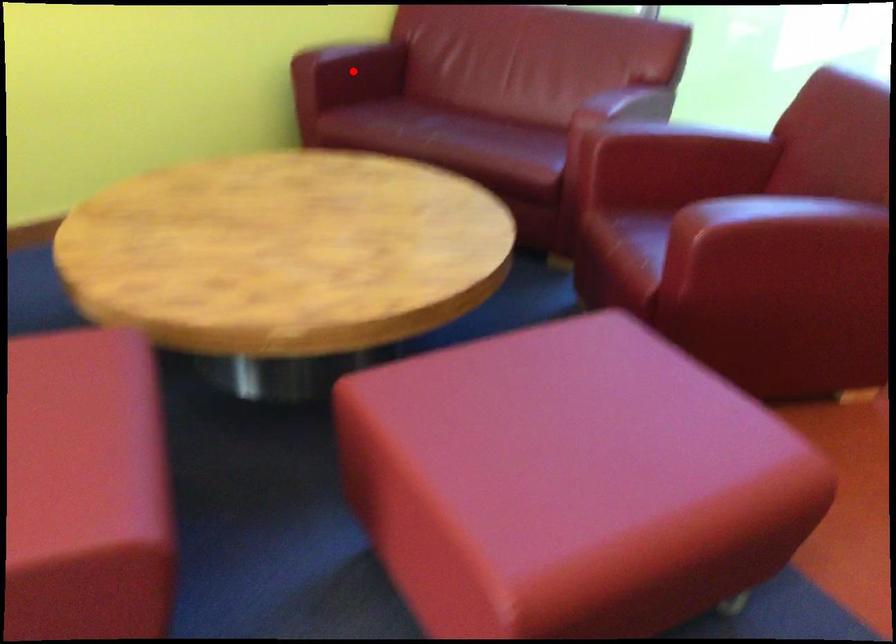
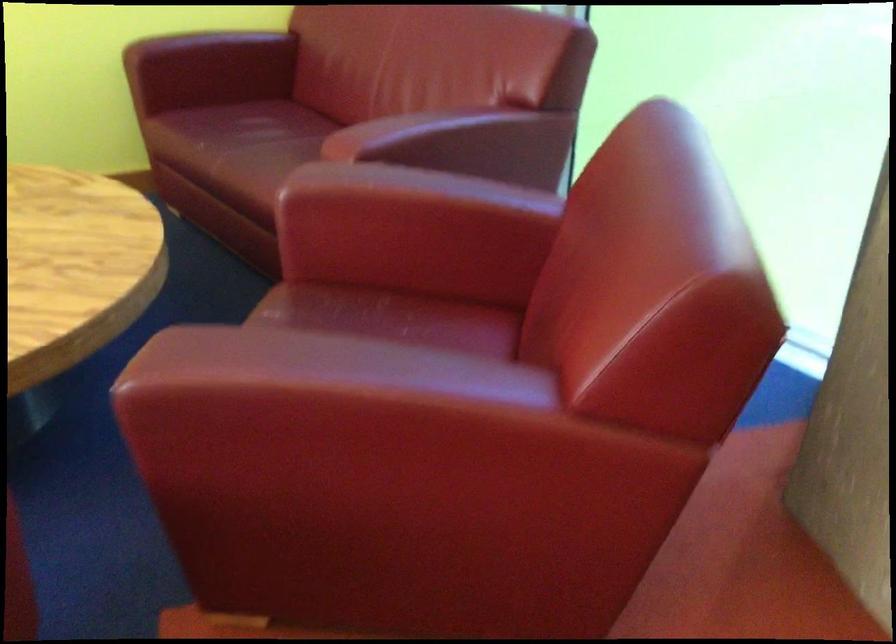
The point at the highlighted location is marked in the first image. Where is the corresponding point in the second image?

(208, 69)